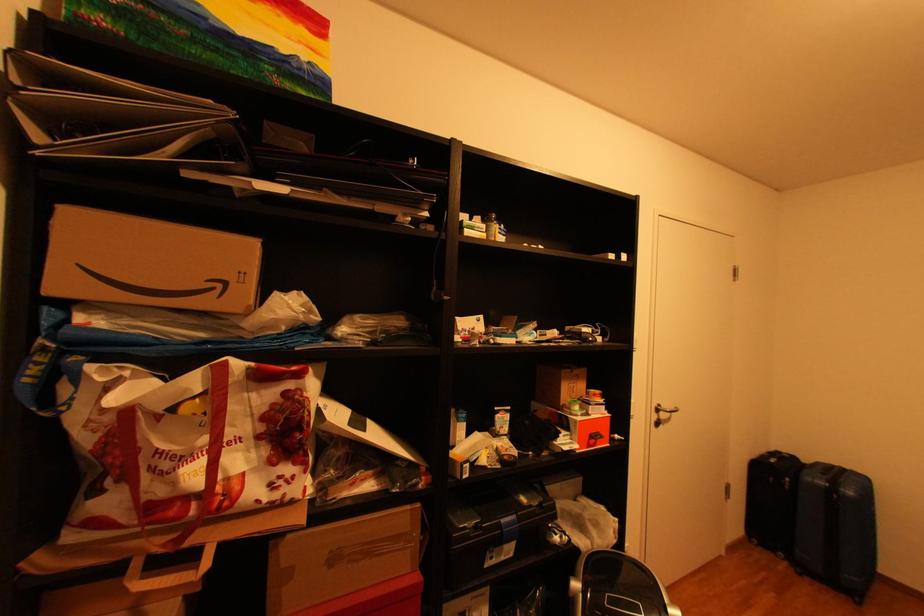
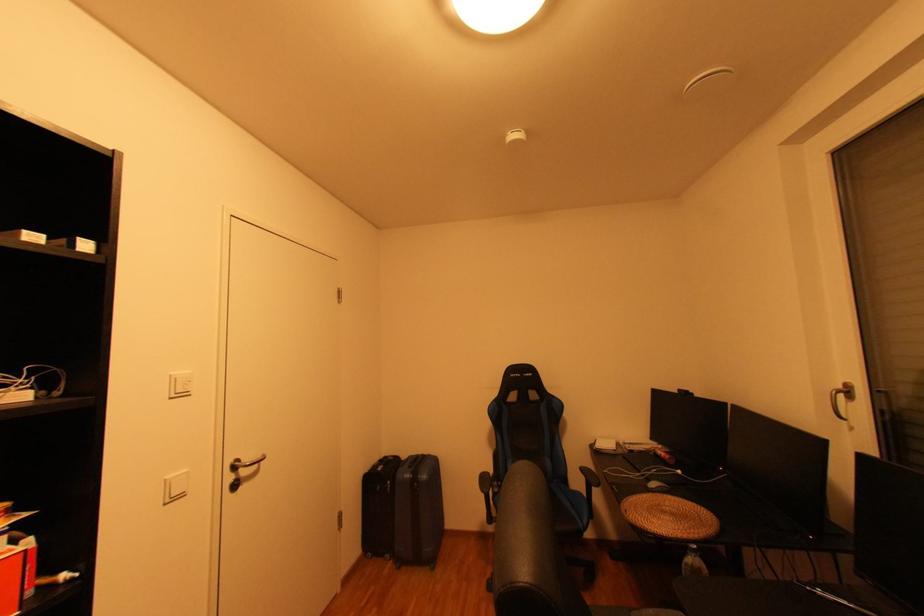
Find the pixel in the second image that matches (796,562) in the first image.

(400, 562)